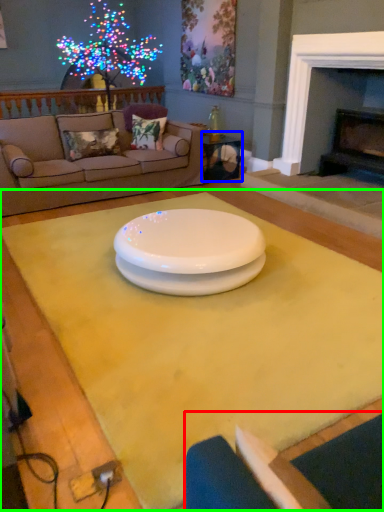
Question: Considering the real-world distances, which object is closest to armchair (highlighted by a red box)? table (highlighted by a blue box) or table (highlighted by a green box).

Choices:
 (A) table
 (B) table

Answer: (B)